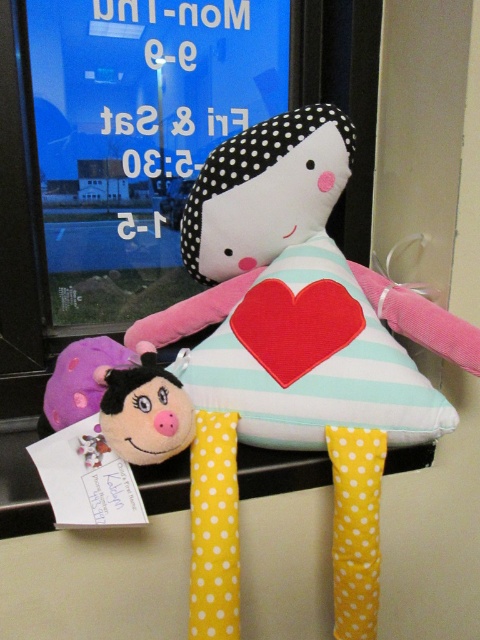
Can you confirm if soft fabric rag doll with heart at center is taller than fluffy pink plush at lower left?

Correct, soft fabric rag doll with heart at center is much taller as fluffy pink plush at lower left.

Can you confirm if soft fabric rag doll with heart at center is thinner than fluffy pink plush at lower left?

No.

This screenshot has height=640, width=480. I want to click on soft fabric rag doll with heart at center, so click(255, 211).

I want to click on soft fabric rag doll with heart at center, so click(255, 211).